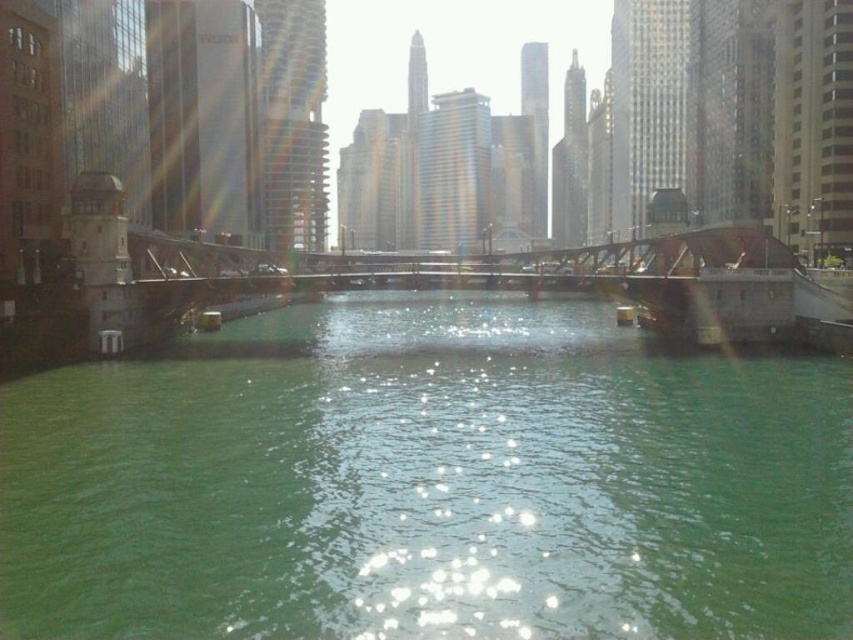
You are a city planner analyzing the river area. You need to determine which of the two objects, the green water at center or the metallic bridge at center, occupies a larger area in the scene. Based on the provided information, which one is bigger?

The metallic bridge at center is larger than the green water at center.

You are a city planner analyzing the layout of this urban area. The bridge with a distinctive reddishbrown arch is positioned at the lower right of the image. Can you determine if the green water at center is situated to the left or right of the bridge?

The green water at center is located at point [428,483], which places it to the right of the bridge positioned at the lower right of the image.

You are a tourist standing on the left bank of the river and want to cross to the right bank using the bridge. Which direction should you walk towards to reach the metallic brown bridge at right from the green water at center?

You should walk towards the right from the green water at center to reach the metallic brown bridge at right since the green water at center is to the left of metallic brown bridge at right.